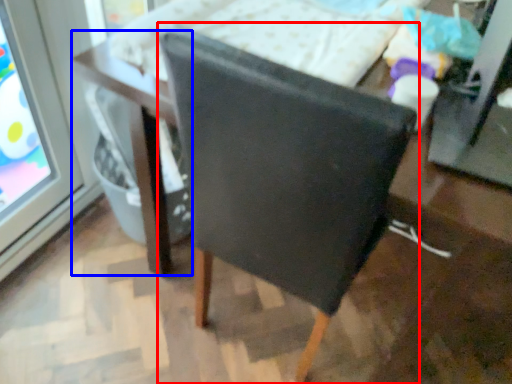
Question: Which object is closer to the camera taking this photo, chair (highlighted by a red box) or table (highlighted by a blue box)?

Choices:
 (A) chair
 (B) table

Answer: (A)